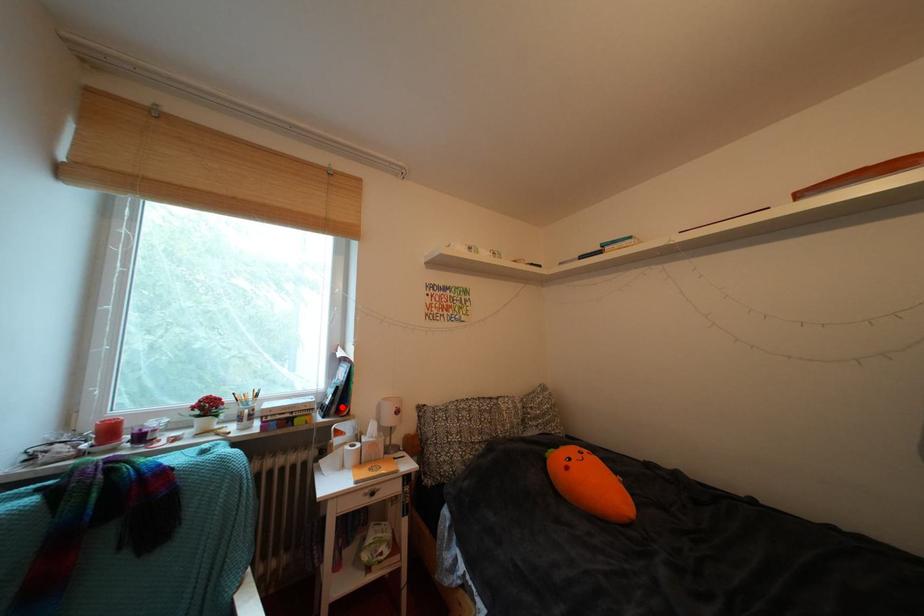
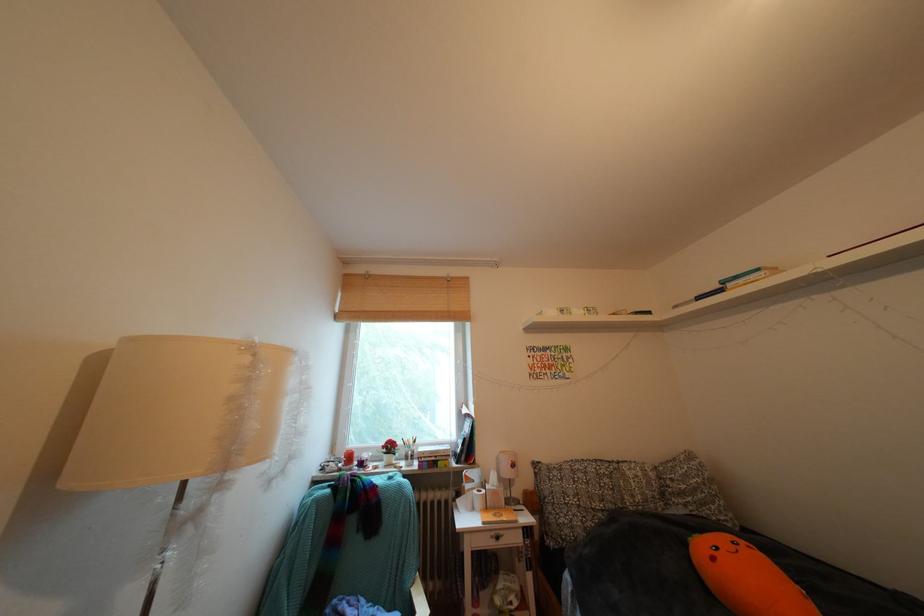
In the second image, find the point that corresponds to the highlighted location in the first image.

(472, 456)